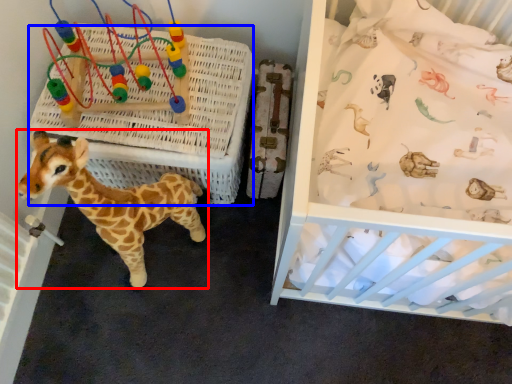
Question: Which point is closer to the camera, giraffe (highlighted by a red box) or crate (highlighted by a blue box)?

Choices:
 (A) giraffe
 (B) crate

Answer: (A)